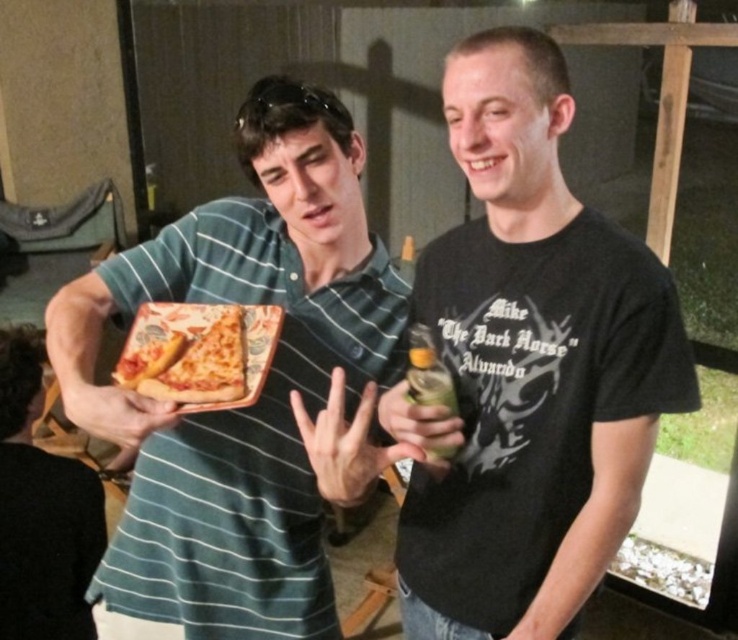
Question: Which object is positioned farthest from the green striped polo shirt at left?

Choices:
 (A) black matte t-shirt at center
 (B) matte ceramic platter at center

Answer: (A)

Question: Which point is farther from the camera taking this photo?

Choices:
 (A) (201, 336)
 (B) (351, 253)

Answer: (B)

Question: Can you confirm if black matte t-shirt at center is bigger than matte ceramic platter at center?

Choices:
 (A) yes
 (B) no

Answer: (A)

Question: Which object is the closest to the black matte t-shirt at center?

Choices:
 (A) matte ceramic platter at center
 (B) green striped polo shirt at left

Answer: (B)

Question: From the image, what is the correct spatial relationship of black matte t-shirt at center in relation to matte ceramic platter at center?

Choices:
 (A) below
 (B) above

Answer: (A)

Question: From the image, what is the correct spatial relationship of black matte t-shirt at center in relation to green striped polo shirt at left?

Choices:
 (A) right
 (B) left

Answer: (A)